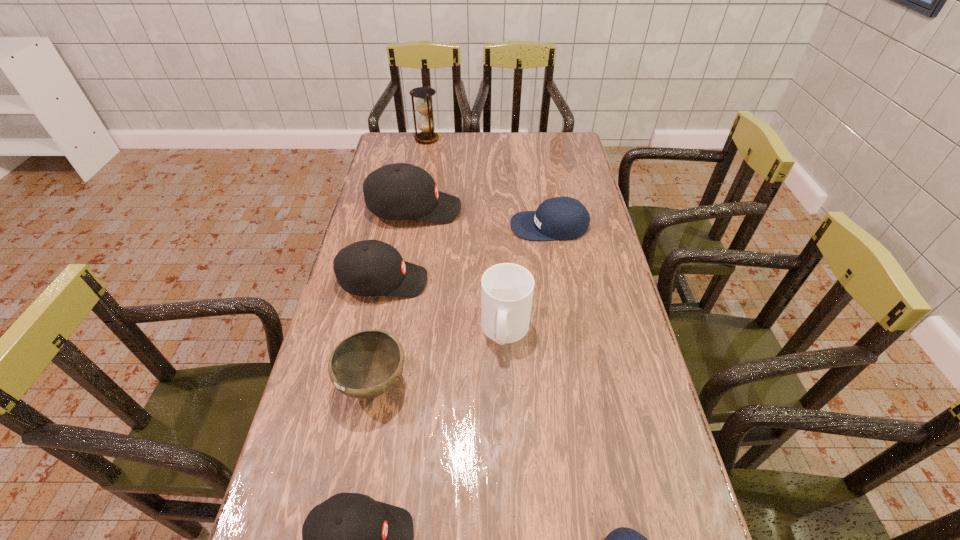
At what (x,y) coordinates should I click in order to perform the action: click on vacant space located on the handle side of the white mug. Please return your answer as a coordinate pair (x, y). Looking at the image, I should click on (509, 390).

Locate an element on the screen. The height and width of the screenshot is (540, 960). free point located with a logo on the front of the farthest gray baseball cap is located at coordinates (518, 210).

At what (x,y) coordinates should I click in order to perform the action: click on vacant space located with a logo on the front of the fourth tallest object. Please return your answer as a coordinate pair (x, y). The height and width of the screenshot is (540, 960). Looking at the image, I should click on (559, 281).

Locate an element on the screen. The width and height of the screenshot is (960, 540). vacant space situated 0.280m on the back of the bowl is located at coordinates (394, 275).

Locate an element on the screen. The height and width of the screenshot is (540, 960). free space located 0.110m on the front-facing side of the farther blue baseball cap is located at coordinates (478, 226).

Where is `vacant space located 0.120m on the front-facing side of the farther blue baseball cap`? This screenshot has height=540, width=960. vacant space located 0.120m on the front-facing side of the farther blue baseball cap is located at coordinates (474, 226).

This screenshot has height=540, width=960. Identify the location of free space located 0.110m on the front-facing side of the farther blue baseball cap. (478, 226).

Locate an element on the screen. Image resolution: width=960 pixels, height=540 pixels. object that is at the far edge is located at coordinates (423, 104).

The image size is (960, 540). I want to click on hourglass that is at the left edge, so pos(423,104).

The height and width of the screenshot is (540, 960). In order to click on bowl present at the left edge in this screenshot , I will do `click(366, 364)`.